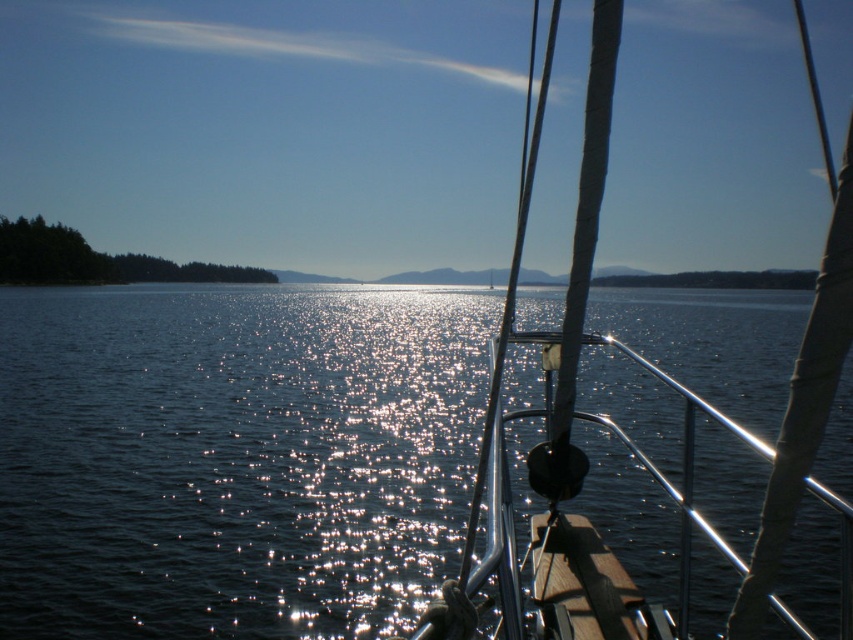
You are standing on the deck of the sailboat and want to know how far you are from the point at coordinates point (230, 410). Can you determine the distance?

The distance between you and the point (230, 410) is 95.74 feet.

You are standing on the deck of a sailboat and want to locate the sparkling blue water at center. According to the coordinates provided, where would you look relative to your position?

The sparkling blue water at center is located at coordinates point 0.716 on the x axis and 0.274 on the y axis. Since the perspective is from the deck, looking towards the center of the water would mean facing forward and slightly to the right, as the x coordinate is closer to 1.0 which typically represents the right side in such coordinate systems.

You are standing on the deck of the sailboat and want to look at the sparkling blue water at center. According to the coordinates provided, where should you look? Please provide the coordinates in the format of a point like point [233,458]

The sparkling blue water at center is located at point [233,458].